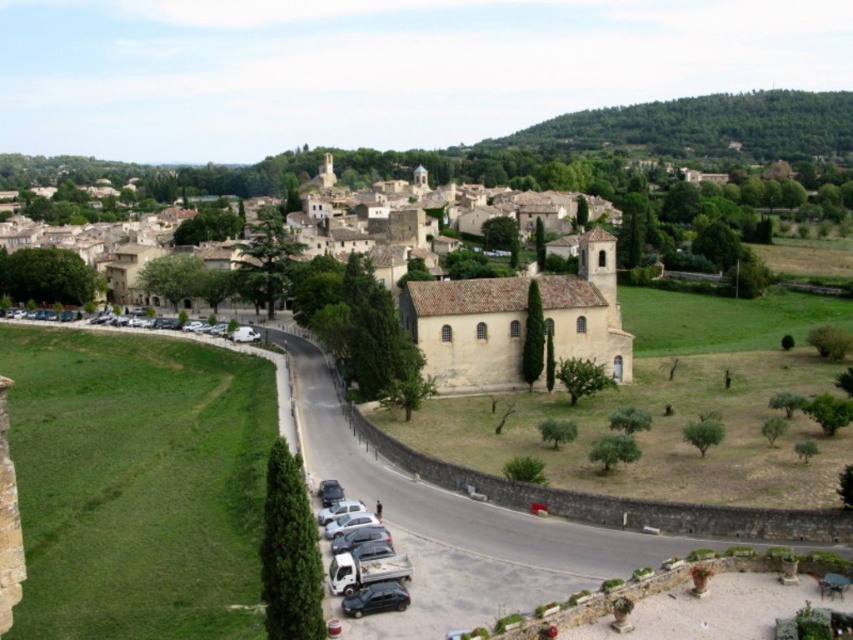
Who is lower down, yellow stone church at center or green leafy hillside at upper right?

yellow stone church at center is below.

Can you confirm if yellow stone church at center is shorter than green leafy hillside at upper right?

No.

Is point (514, 349) farther from viewer compared to point (503, 147)?

That is False.

At what (x,y) coordinates should I click in order to perform the action: click on yellow stone church at center. Please return your answer as a coordinate pair (x, y). The height and width of the screenshot is (640, 853). Looking at the image, I should click on (437, 280).

Is point (518, 138) closer to viewer compared to point (381, 566)?

No, (518, 138) is further to viewer.

Which is in front, point (610, 108) or point (389, 545)?

Positioned in front is point (389, 545).

Measure the distance between point [786,104] and camera.

Point [786,104] and camera are 465.29 meters apart.

At what (x,y) coordinates should I click in order to perform the action: click on green leafy hillside at upper right. Please return your answer as a coordinate pair (x, y). Image resolution: width=853 pixels, height=640 pixels. Looking at the image, I should click on (705, 125).

Which is more to the left, yellow stone church at center or metallic silver truck at lower center?

Positioned to the left is yellow stone church at center.

Where is `yellow stone church at center`? The height and width of the screenshot is (640, 853). yellow stone church at center is located at coordinates (437, 280).

Does point (577, 323) lie in front of point (376, 570)?

No, (577, 323) is further to viewer.

Where is `yellow stone church at center`? yellow stone church at center is located at coordinates (437, 280).